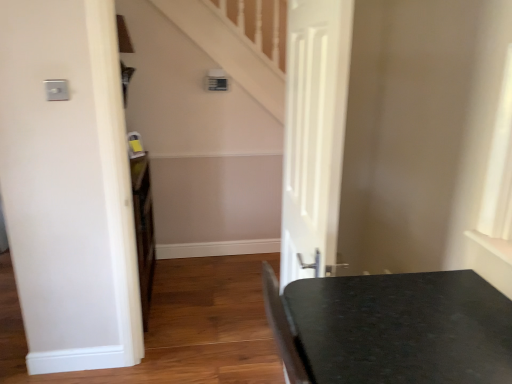
Question: Would you consider black granite table at lower right to be distant from white matte door at center?

Choices:
 (A) yes
 (B) no

Answer: (B)

Question: Could you tell me if black granite table at lower right is turned towards white matte door at center?

Choices:
 (A) yes
 (B) no

Answer: (B)

Question: Does black granite table at lower right appear on the right side of white matte door at center?

Choices:
 (A) no
 (B) yes

Answer: (B)

Question: From a real-world perspective, is black granite table at lower right positioned over white matte door at center based on gravity?

Choices:
 (A) yes
 (B) no

Answer: (A)

Question: Considering the relative sizes of black granite table at lower right and white matte door at center in the image provided, is black granite table at lower right bigger than white matte door at center?

Choices:
 (A) no
 (B) yes

Answer: (B)

Question: Is black granite table at lower right outside white matte door at center?

Choices:
 (A) no
 (B) yes

Answer: (B)

Question: From the image's perspective, is white matte door at center over black granite table at lower right?

Choices:
 (A) yes
 (B) no

Answer: (A)

Question: Is white matte door at center bigger than black granite table at lower right?

Choices:
 (A) no
 (B) yes

Answer: (A)

Question: Considering the relative sizes of white matte door at center and black granite table at lower right in the image provided, is white matte door at center shorter than black granite table at lower right?

Choices:
 (A) yes
 (B) no

Answer: (B)

Question: Does white matte door at center have a lesser width compared to black granite table at lower right?

Choices:
 (A) no
 (B) yes

Answer: (B)

Question: From a real-world perspective, is white matte door at center physically below black granite table at lower right?

Choices:
 (A) yes
 (B) no

Answer: (A)

Question: Considering the relative positions of white matte door at center and black granite table at lower right in the image provided, is white matte door at center to the right of black granite table at lower right from the viewer's perspective?

Choices:
 (A) no
 (B) yes

Answer: (A)

Question: Based on their positions, is black granite table at lower right located to the left or right of white matte door at center?

Choices:
 (A) right
 (B) left

Answer: (A)